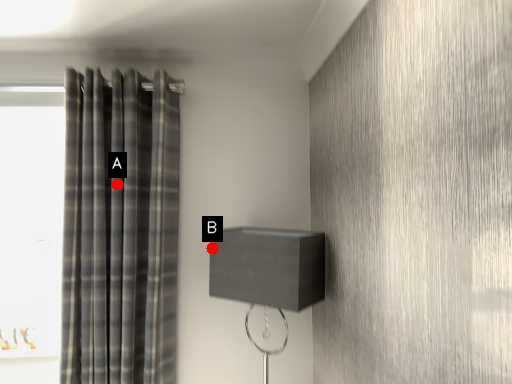
Question: Two points are circled on the image, labeled by A and B beside each circle. Which point is closer to the camera?

Choices:
 (A) A is closer
 (B) B is closer

Answer: (A)